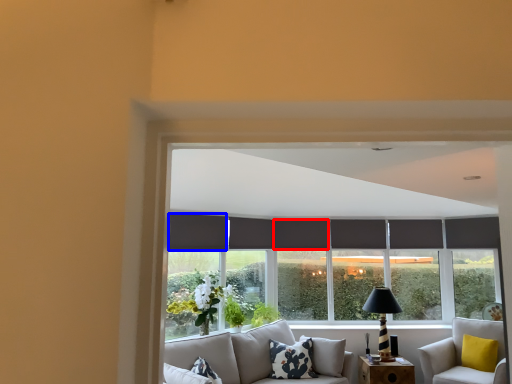
Question: Among these objects, which one is nearest to the camera, curtain (highlighted by a red box) or curtain (highlighted by a blue box)?

Choices:
 (A) curtain
 (B) curtain

Answer: (B)